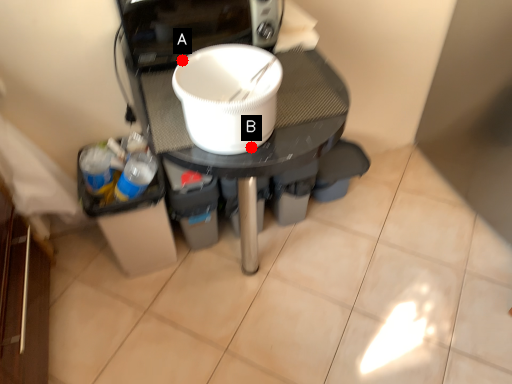
Question: Two points are circled on the image, labeled by A and B beside each circle. Which point appears farthest from the camera in this image?

Choices:
 (A) A is further
 (B) B is further

Answer: (A)